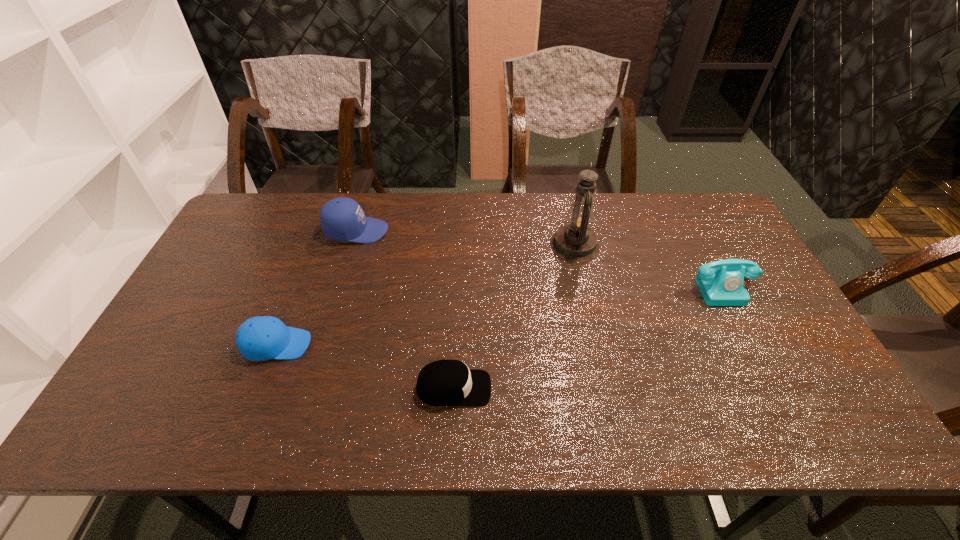
Where is `vacant space situated 0.060m on the dial of the rightmost object`? This screenshot has height=540, width=960. vacant space situated 0.060m on the dial of the rightmost object is located at coordinates (742, 323).

At what (x,y) coordinates should I click in order to perform the action: click on free spot located on the front-facing side of the second nearest object. Please return your answer as a coordinate pair (x, y). The height and width of the screenshot is (540, 960). Looking at the image, I should click on (412, 345).

Identify the location of free space located 0.290m on the front-facing side of the third object from left to right. (613, 388).

Identify the location of oil lamp at the far edge. This screenshot has width=960, height=540. (575, 241).

The image size is (960, 540). Find the location of `cap located at the far edge`. cap located at the far edge is located at coordinates (342, 219).

Image resolution: width=960 pixels, height=540 pixels. What are the coordinates of `object that is at the near edge` in the screenshot? It's located at (445, 383).

Find the location of a particular element. The width and height of the screenshot is (960, 540). object at the right edge is located at coordinates (720, 283).

Locate an element on the screen. This screenshot has width=960, height=540. free space at the far edge of the desktop is located at coordinates (391, 205).

At what (x,y) coordinates should I click in order to perform the action: click on free space at the near edge of the desktop. Please return your answer as a coordinate pair (x, y). The width and height of the screenshot is (960, 540). Looking at the image, I should click on (390, 412).

Identify the location of vacant space at the left edge of the desktop. (193, 321).